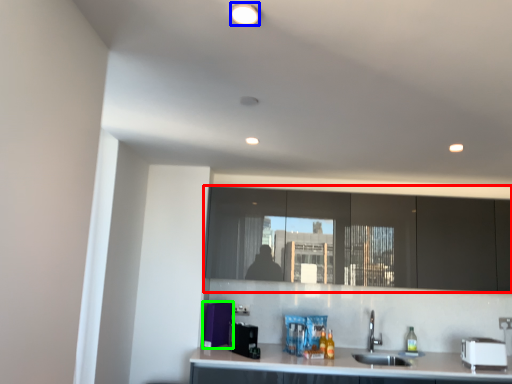
Question: Based on their relative distances, which object is nearer to cabinetry (highlighted by a red box)? Choose from lighting (highlighted by a blue box) and appliance (highlighted by a green box).

Choices:
 (A) lighting
 (B) appliance

Answer: (B)